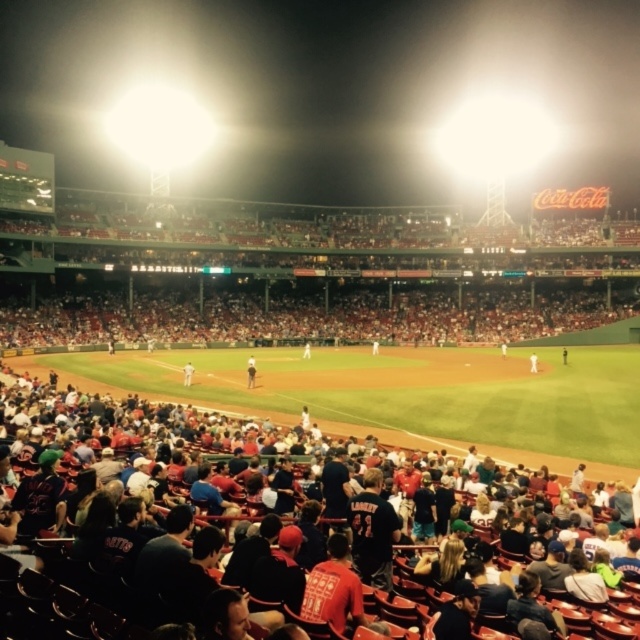
Question: Is white uniform at center positioned in front of dark blue jersey at center?

Choices:
 (A) yes
 (B) no

Answer: (A)

Question: Among these points, which one is nearest to the camera?

Choices:
 (A) (566, 353)
 (B) (189, 365)
 (C) (253, 378)
 (D) (534, 358)

Answer: (C)

Question: Which of the following is the farthest from the observer?

Choices:
 (A) (253, 380)
 (B) (182, 380)

Answer: (B)

Question: Considering the relative positions of light brown leather baseball glove at center and white uniform at center in the image provided, where is light brown leather baseball glove at center located with respect to white uniform at center?

Choices:
 (A) above
 (B) below

Answer: (A)

Question: Which of the following is the closest to the observer?

Choices:
 (A) dark blue jersey at center
 (B) white uniform at center
 (C) white uniformed player at center
 (D) light brown leather baseball glove at center

Answer: (D)

Question: Can you confirm if light brown leather baseball glove at center is thinner than white uniformed player at center?

Choices:
 (A) no
 (B) yes

Answer: (A)